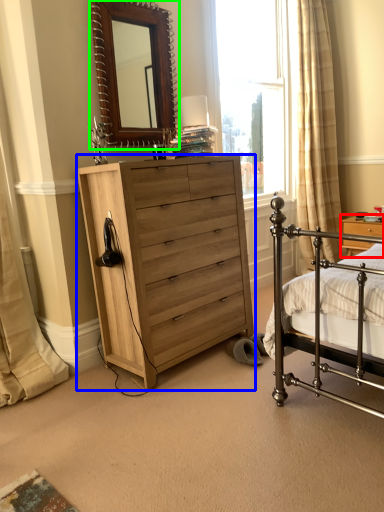
Question: Based on their relative distances, which object is nearer to nightstand (highlighted by a red box)? Choose from chest of drawers (highlighted by a blue box) and mirror (highlighted by a green box).

Choices:
 (A) chest of drawers
 (B) mirror

Answer: (A)